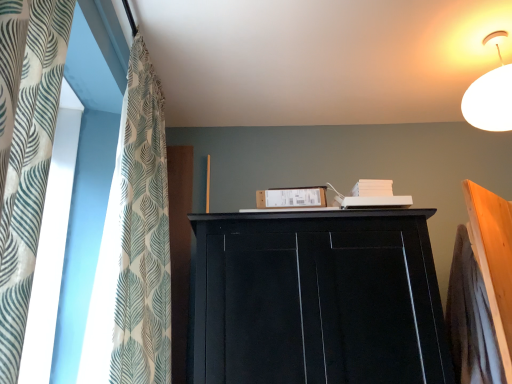
Question: Does point (369, 228) appear closer or farther from the camera than point (147, 86)?

Choices:
 (A) closer
 (B) farther

Answer: (A)

Question: Is black matte cupboard at upper center wider or thinner than white textured fabric at left?

Choices:
 (A) thin
 (B) wide

Answer: (B)

Question: Based on their sizes in the image, would you say black matte cupboard at upper center is bigger or smaller than white textured fabric at left?

Choices:
 (A) small
 (B) big

Answer: (B)

Question: Relative to black matte cupboard at upper center, is white textured fabric at left in front or behind?

Choices:
 (A) behind
 (B) front

Answer: (B)

Question: In terms of width, does white textured fabric at left look wider or thinner when compared to black matte cupboard at upper center?

Choices:
 (A) thin
 (B) wide

Answer: (A)

Question: Does point (141, 266) appear closer or farther from the camera than point (266, 331)?

Choices:
 (A) closer
 (B) farther

Answer: (A)

Question: Considering the positions of white textured fabric at left and black matte cupboard at upper center in the image, is white textured fabric at left taller or shorter than black matte cupboard at upper center?

Choices:
 (A) tall
 (B) short

Answer: (A)